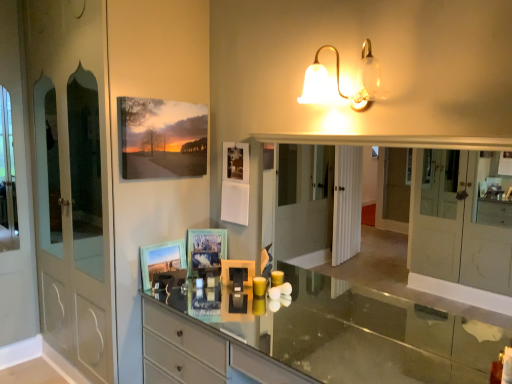
Question: In which direction should I rotate to look at matte glass picture frame at center, arranged as the 1th picture frame when ordered from the bottom?

Choices:
 (A) left
 (B) right

Answer: (A)

Question: From the image's perspective, is clear glass mirror at center located above matte glass picture frame at center, arranged as the 1th picture frame when ordered from the bottom?

Choices:
 (A) no
 (B) yes

Answer: (B)

Question: Can you confirm if clear glass mirror at center is shorter than matte glass picture frame at center, arranged as the 1th picture frame when ordered from the bottom?

Choices:
 (A) yes
 (B) no

Answer: (B)

Question: Is clear glass mirror at center not close to matte glass picture frame at center, arranged as the 1th picture frame when ordered from the bottom?

Choices:
 (A) no
 (B) yes

Answer: (B)

Question: Considering the relative sizes of clear glass mirror at center and matte glass picture frame at center, arranged as the 1th picture frame when ordered from the bottom, in the image provided, is clear glass mirror at center bigger than matte glass picture frame at center, arranged as the 1th picture frame when ordered from the bottom,?

Choices:
 (A) no
 (B) yes

Answer: (B)

Question: From the image's perspective, is clear glass mirror at center below matte glass picture frame at center, the 3th picture frame in the top-to-bottom sequence?

Choices:
 (A) yes
 (B) no

Answer: (B)

Question: Considering the relative positions of clear glass mirror at center and matte glass picture frame at center, arranged as the 1th picture frame when ordered from the bottom, in the image provided, is clear glass mirror at center in front of matte glass picture frame at center, arranged as the 1th picture frame when ordered from the bottom,?

Choices:
 (A) no
 (B) yes

Answer: (B)

Question: Does smooth glass countertop at center have a lesser height compared to matte glass picture frame at center, the 3th picture frame in the top-to-bottom sequence?

Choices:
 (A) no
 (B) yes

Answer: (A)

Question: Is smooth glass countertop at center to the left of matte glass picture frame at center, arranged as the 1th picture frame when ordered from the bottom, from the viewer's perspective?

Choices:
 (A) yes
 (B) no

Answer: (B)

Question: Is smooth glass countertop at center far away from matte glass picture frame at center, arranged as the 1th picture frame when ordered from the bottom?

Choices:
 (A) no
 (B) yes

Answer: (B)

Question: Does smooth glass countertop at center turn towards matte glass picture frame at center, arranged as the 1th picture frame when ordered from the bottom?

Choices:
 (A) yes
 (B) no

Answer: (B)

Question: Considering the relative sizes of smooth glass countertop at center and matte glass picture frame at center, the 3th picture frame in the top-to-bottom sequence, in the image provided, is smooth glass countertop at center taller than matte glass picture frame at center, the 3th picture frame in the top-to-bottom sequence,?

Choices:
 (A) no
 (B) yes

Answer: (B)

Question: Does smooth glass countertop at center contain matte glass picture frame at center, arranged as the 1th picture frame when ordered from the bottom?

Choices:
 (A) yes
 (B) no

Answer: (B)

Question: Can you confirm if matte canvas painting at upper left, marked as the first picture frame in a top-to-bottom arrangement, is wider than clear glass mirror at center?

Choices:
 (A) no
 (B) yes

Answer: (A)